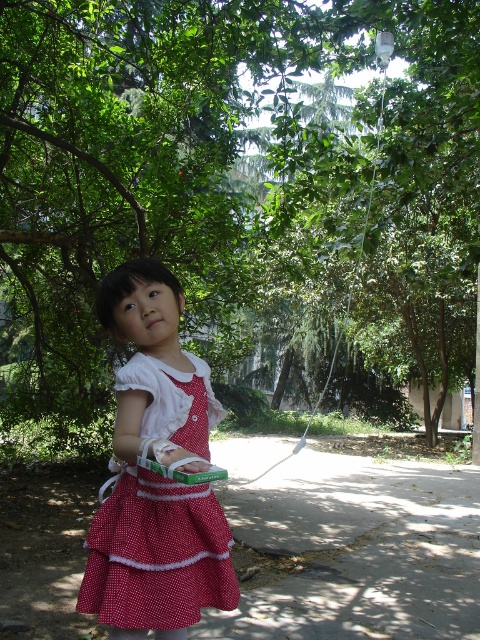
You are a gardener planning to plant a new tree in this area. Considering the space available between the green leafy tree at center and the gray concrete pavement at lower center, do you think there is enough room for a tree that requires 3 meters of width?

The green leafy tree at center might be wider than gray concrete pavement at lower center, so there may not be enough space for a tree requiring 3 meters of width. Check the actual distance before planting.

You are a delivery robot trying to reach a package on the gray concrete pavement at lower center. There is a green leafy tree at center blocking your path. Can you go around it to the right?

The green leafy tree at center is to the left of gray concrete pavement at lower center, so yes, you can go around it to the right to reach the gray concrete pavement at lower center.

You are standing in a park and want to reach a specific point to plant a flag. The point is located at coordinates point [409,582]. Given that you can walk 4 meters in 1 minute, how long will it take you to reach the point?

The distance to point [409,582] is 3.63 meters. At a walking speed of 4 meters per minute, it will take approximately 54.45 seconds to reach the point.